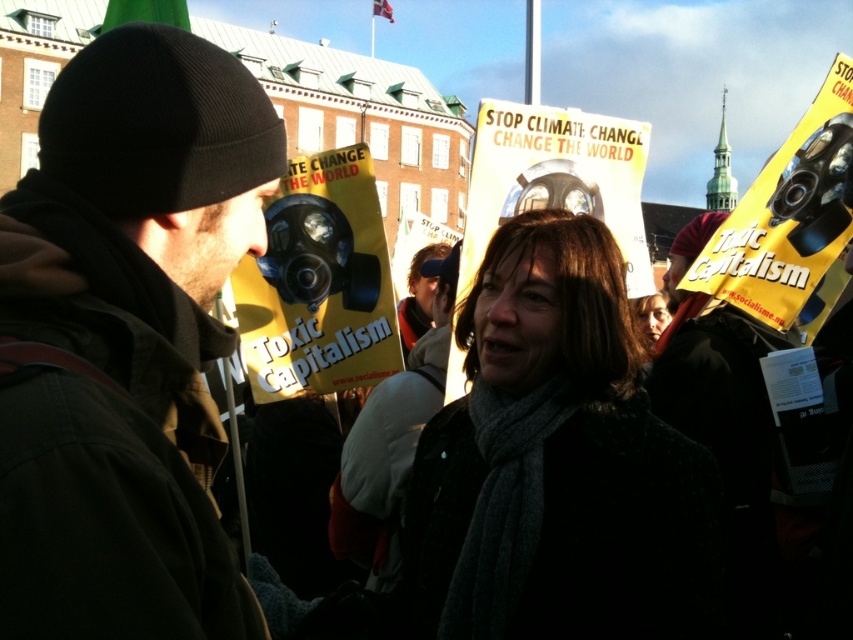
You are a photographer trying to capture a closeup of the dark brown knit hat at upper left and the dark gray scarf at center. Which object should you zoom in on first to ensure it fits entirely within the frame?

The dark brown knit hat at upper left is bigger than the dark gray scarf at center, so you should zoom in on the dark brown knit hat at upper left first to ensure it fits entirely within the frame.

You are a photographer trying to capture a closeup of the dark gray knit hat at center and the dark gray scarf at center. Which object should you focus on first if you want to ensure both are in focus?

The dark gray knit hat at center is positioned over the dark gray scarf at center, so focusing on the hat first would ensure both are in focus as they are layered on top of each other.